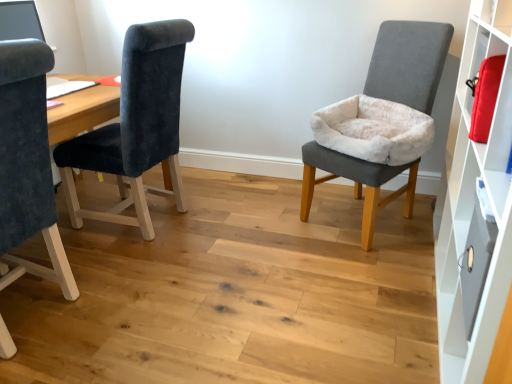
Locate an element on the screen. free space in front of velvet dark blue chair at left, positioned as the second chair in right-to-left order is located at coordinates click(153, 269).